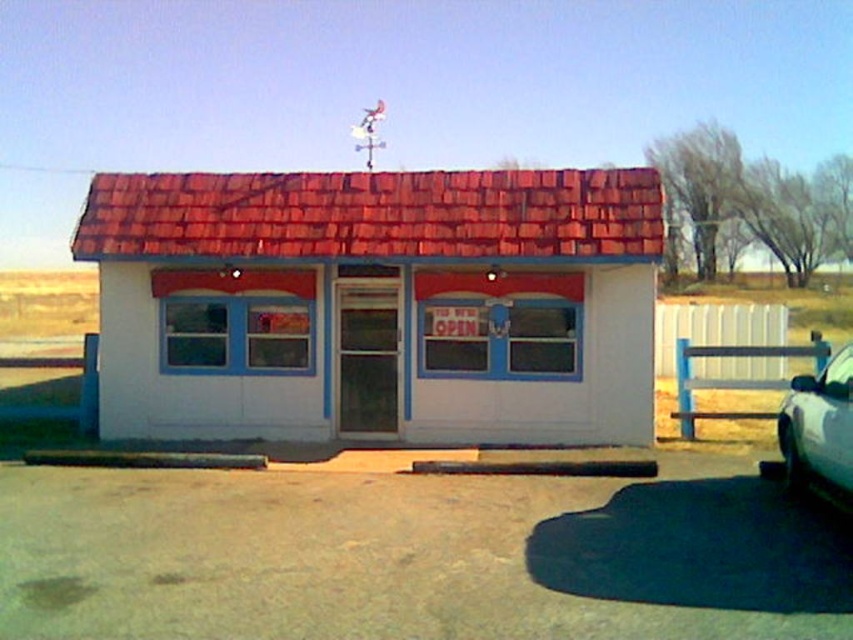
You are a delivery person trying to park your silver metallic car at lower right next to the white painted wood shed at center. Can you park your car there without hitting the shed?

The white painted wood shed at center is not as tall as the silver metallic car at lower right, so parking next to it should be possible without hitting the shed since the car is taller but not wider.

You are a customer arriving at the building and want to park your car. You see the white painted wood shed at center and the silver metallic car at lower right. Where should you park your car to avoid blocking the shed?

The silver metallic car at lower right is behind the white painted wood shed at center, so you should park your car in front of the white painted wood shed at center to avoid blocking it.

You are standing in front of the building and want to park your car. The white painted wood shed at center is in the way. Can you drive around it to reach the silver metallic car at lower right?

The white painted wood shed at center is to the left of the silver metallic car at lower right, so you can drive around the shed to the right side to reach the silver metallic car at lower right.